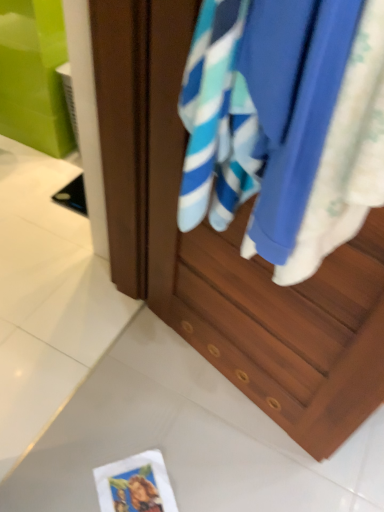
Locate an element on the screen. This screenshot has height=512, width=384. space that is in front of wooden cabinet at center is located at coordinates (228, 446).